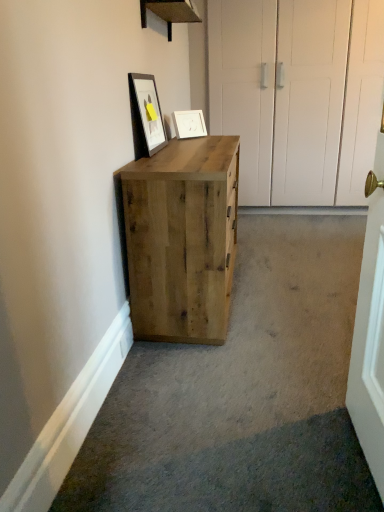
Locate an element on the screen. The height and width of the screenshot is (512, 384). matte black picture frame at upper center, the second picture frame viewed from the right is located at coordinates (146, 115).

What is the approximate width of natural wood cabinet at center?

17.40 inches.

Where is `white matte picture frame at upper center, the 2th picture frame in the front-to-back sequence`? The image size is (384, 512). white matte picture frame at upper center, the 2th picture frame in the front-to-back sequence is located at coordinates (189, 124).

Identify the location of matte black picture frame at upper center, the second picture frame from the back. This screenshot has width=384, height=512. (146, 115).

Who is smaller, natural wood cabinet at center or matte black picture frame at upper center, the second picture frame viewed from the right?

matte black picture frame at upper center, the second picture frame viewed from the right, is smaller.

Considering the relative sizes of natural wood cabinet at center and matte black picture frame at upper center, the second picture frame viewed from the right, in the image provided, is natural wood cabinet at center wider than matte black picture frame at upper center, the second picture frame viewed from the right,?

Yes.

Is point (125, 213) farther from viewer compared to point (150, 125)?

That is False.

Relative to matte black picture frame at upper center, acting as the first picture frame starting from the front, is natural wood cabinet at center in front or behind?

In the image, natural wood cabinet at center appears in front of matte black picture frame at upper center, acting as the first picture frame starting from the front.

From their relative heights in the image, would you say matte black picture frame at upper center, the second picture frame from the back, is taller or shorter than natural wood cabinet at center?

Considering their sizes, matte black picture frame at upper center, the second picture frame from the back, has less height than natural wood cabinet at center.

Based on the photo, can you tell me how much matte black picture frame at upper center, acting as the first picture frame starting from the front, and natural wood cabinet at center differ in facing direction?

The facing directions of matte black picture frame at upper center, acting as the first picture frame starting from the front, and natural wood cabinet at center are 0.829 degrees apart.

Does point (159, 119) appear closer or farther from the camera than point (166, 236)?

Point (159, 119) is farther from the camera than point (166, 236).

Considering the positions of objects matte black picture frame at upper center, acting as the first picture frame starting from the front, and natural wood cabinet at center in the image provided, who is behind, matte black picture frame at upper center, acting as the first picture frame starting from the front, or natural wood cabinet at center?

matte black picture frame at upper center, acting as the first picture frame starting from the front, is further away from the camera.

Considering the positions of objects white matte picture frame at upper center, the 1th picture frame positioned from the right, and matte black picture frame at upper center, which is the first picture frame from left to right, in the image provided, who is behind, white matte picture frame at upper center, the 1th picture frame positioned from the right, or matte black picture frame at upper center, which is the first picture frame from left to right,?

white matte picture frame at upper center, the 1th picture frame positioned from the right.

From the image's perspective, which is above, white matte picture frame at upper center, the 1th picture frame positioned from the right, or matte black picture frame at upper center, the second picture frame viewed from the right?

white matte picture frame at upper center, the 1th picture frame positioned from the right, is shown above in the image.

Can you confirm if white matte picture frame at upper center, the 1th picture frame positioned from the right, is thinner than matte black picture frame at upper center, acting as the first picture frame starting from the front?

No.

Would you consider white matte picture frame at upper center, the second picture frame viewed from the left, to be distant from natural wood cabinet at center?

white matte picture frame at upper center, the second picture frame viewed from the left, is actually quite close to natural wood cabinet at center.

This screenshot has height=512, width=384. I want to click on the chest of drawers directly beneath the white matte picture frame at upper center, the 1th picture frame positioned from the right (from a real-world perspective), so click(x=182, y=239).

Is white matte picture frame at upper center, the 1th picture frame positioned from the right, facing towards natural wood cabinet at center?

No, white matte picture frame at upper center, the 1th picture frame positioned from the right, is not facing towards natural wood cabinet at center.

This screenshot has width=384, height=512. In order to click on the 1st picture frame positioned above the natural wood cabinet at center (from a real-world perspective) in this screenshot , I will do `click(189, 124)`.

Could white matte picture frame at upper center, the 1th picture frame from the back, be considered to be inside natural wood cabinet at center?

Actually, white matte picture frame at upper center, the 1th picture frame from the back, is outside natural wood cabinet at center.

Between point (220, 321) and point (176, 125), which one is positioned in front?

The point (220, 321) is closer.

How many degrees apart are the facing directions of natural wood cabinet at center and white matte picture frame at upper center, the 1th picture frame from the back?

44.2 degrees.

Which of these two, matte black picture frame at upper center, the second picture frame from the back, or white matte picture frame at upper center, the 1th picture frame positioned from the right, is thinner?

Thinner between the two is matte black picture frame at upper center, the second picture frame from the back.

From a real-world perspective, who is located lower, matte black picture frame at upper center, acting as the first picture frame starting from the front, or white matte picture frame at upper center, the second picture frame viewed from the left?

white matte picture frame at upper center, the second picture frame viewed from the left, is physically lower.

Are matte black picture frame at upper center, the second picture frame from the back, and white matte picture frame at upper center, the 1th picture frame from the back, located far from each other?

No, matte black picture frame at upper center, the second picture frame from the back, is not far from white matte picture frame at upper center, the 1th picture frame from the back.

Could you tell me if matte black picture frame at upper center, the second picture frame from the back, is facing white matte picture frame at upper center, the 2th picture frame in the front-to-back sequence?

No, matte black picture frame at upper center, the second picture frame from the back, is not facing towards white matte picture frame at upper center, the 2th picture frame in the front-to-back sequence.

At what (x,y) coordinates should I click in order to perform the action: click on the 2nd picture frame positioned above the natural wood cabinet at center (from a real-world perspective). Please return your answer as a coordinate pair (x, y). Looking at the image, I should click on (146, 115).

At what (x,y) coordinates should I click in order to perform the action: click on chest of drawers in front of the matte black picture frame at upper center, which is the first picture frame from left to right. Please return your answer as a coordinate pair (x, y). The image size is (384, 512). Looking at the image, I should click on (182, 239).

Considering their positions, is natural wood cabinet at center positioned further to matte black picture frame at upper center, the second picture frame viewed from the right, than white matte picture frame at upper center, the second picture frame viewed from the left?

Based on the image, natural wood cabinet at center appears to be further to matte black picture frame at upper center, the second picture frame viewed from the right.

Considering their positions, is matte black picture frame at upper center, which is the first picture frame from left to right, positioned closer to natural wood cabinet at center than white matte picture frame at upper center, the second picture frame viewed from the left?

Among the two, matte black picture frame at upper center, which is the first picture frame from left to right, is located nearer to natural wood cabinet at center.

Consider the image. Based on their spatial positions, is white matte picture frame at upper center, the second picture frame viewed from the left, or natural wood cabinet at center further from matte black picture frame at upper center, acting as the first picture frame starting from the front?

Based on the image, natural wood cabinet at center appears to be further to matte black picture frame at upper center, acting as the first picture frame starting from the front.

Which object lies further to the anchor point white matte picture frame at upper center, the 1th picture frame from the back, natural wood cabinet at center or matte black picture frame at upper center, which is the first picture frame from left to right?

natural wood cabinet at center lies further to white matte picture frame at upper center, the 1th picture frame from the back, than the other object.

From the image, which object appears to be farther from white matte picture frame at upper center, the second picture frame viewed from the left, matte black picture frame at upper center, which is the first picture frame from left to right, or natural wood cabinet at center?

Based on the image, natural wood cabinet at center appears to be further to white matte picture frame at upper center, the second picture frame viewed from the left.

From the image, which object appears to be nearer to natural wood cabinet at center, white matte picture frame at upper center, the 2th picture frame in the front-to-back sequence, or matte black picture frame at upper center, which is the first picture frame from left to right?

matte black picture frame at upper center, which is the first picture frame from left to right, is closer to natural wood cabinet at center.

The width and height of the screenshot is (384, 512). In order to click on picture frame located between natural wood cabinet at center and white matte picture frame at upper center, the 2th picture frame in the front-to-back sequence, in the depth direction in this screenshot , I will do `click(146, 115)`.